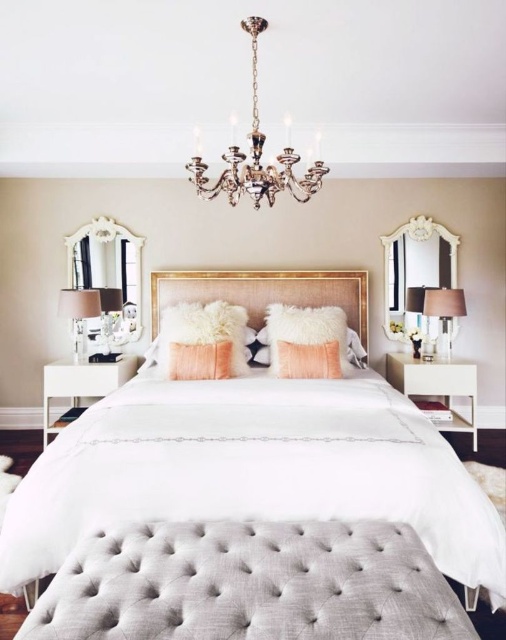
What do you see at coordinates (78, 310) in the screenshot?
I see `matte white lampshade at left` at bounding box center [78, 310].

Is point (78, 337) behind point (105, 339)?

Yes, it is.

Measure the distance between point (76, 346) and camera.

Point (76, 346) and camera are 15.05 feet apart.

Locate an element on the screen. matte white lampshade at left is located at coordinates (78, 310).

Is point (316, 371) farther from camera compared to point (423, 304)?

That is False.

Can you confirm if peachy velvet pillow at center is taller than matte black lampshade at right?

Incorrect, peachy velvet pillow at center's height is not larger of matte black lampshade at right's.

Is point (313, 360) farther from camera compared to point (426, 289)?

No, it is not.

This screenshot has width=506, height=640. I want to click on peachy velvet pillow at center, so click(309, 358).

Does white tufted ottoman at lower center have a lesser height compared to white fluffy pillow at center?

Incorrect, white tufted ottoman at lower center's height does not fall short of white fluffy pillow at center's.

Where is `white tufted ottoman at lower center`? The height and width of the screenshot is (640, 506). white tufted ottoman at lower center is located at coordinates (266, 291).